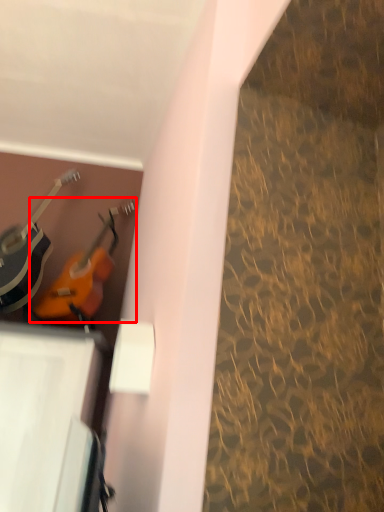
Question: Observing the image, what is the correct spatial positioning of guitar (annotated by the red box) in reference to guitar?

Choices:
 (A) left
 (B) right

Answer: (B)